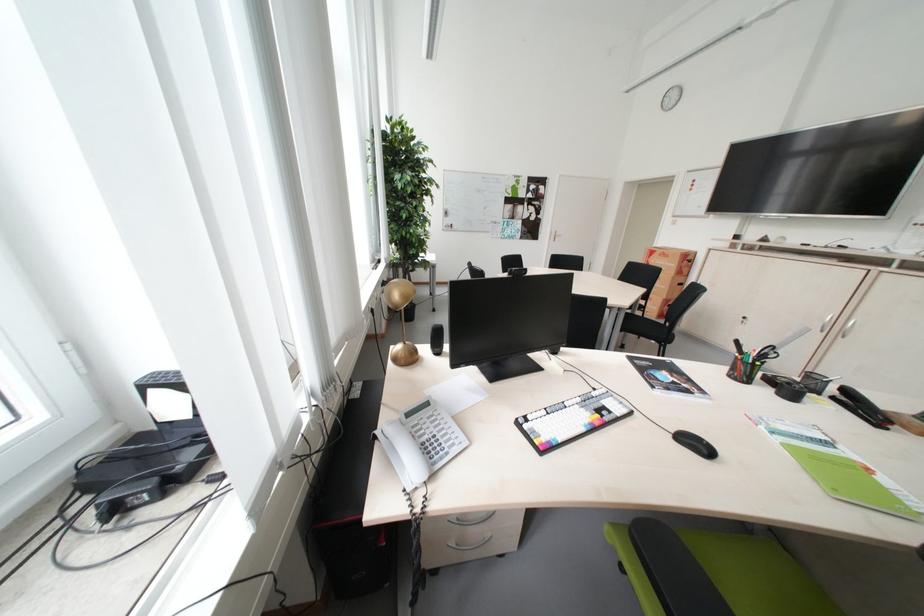
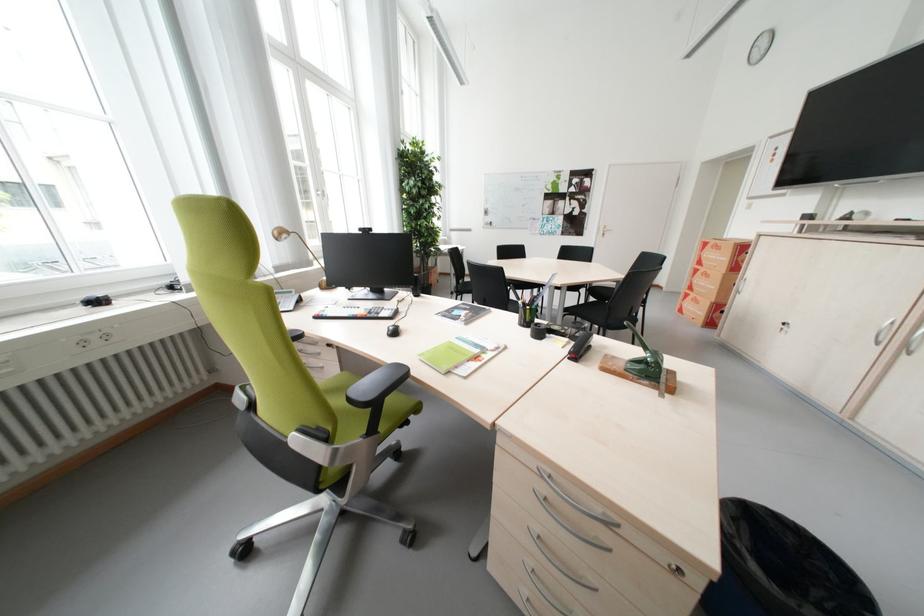
In the second image, find the point that corresponds to (x=662, y=254) in the first image.

(715, 246)